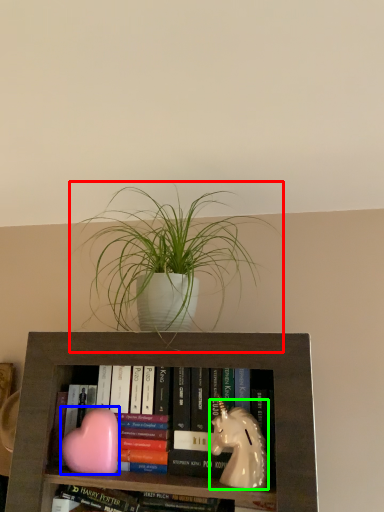
Question: Estimate the real-world distances between objects in this image. Which object is farther from houseplant (highlighted by a red box), animal (highlighted by a blue box) or animal (highlighted by a green box)?

Choices:
 (A) animal
 (B) animal

Answer: (A)